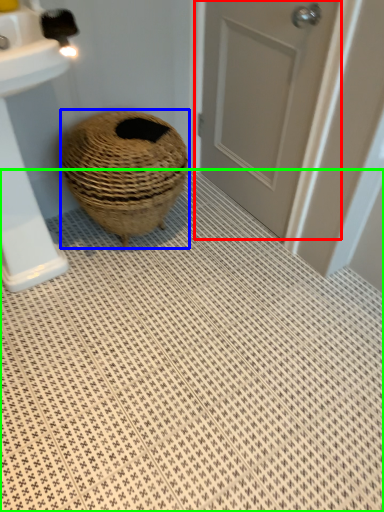
Question: Which is nearer to the door (highlighted by a red box)? basket (highlighted by a blue box) or bath mat (highlighted by a green box).

Choices:
 (A) basket
 (B) bath mat

Answer: (A)